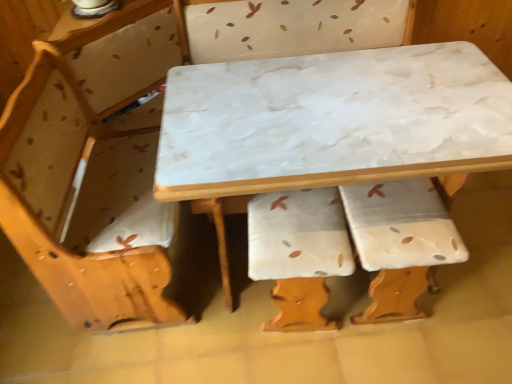
Measure the distance between point (305, 105) and camera.

A distance of 4.21 feet exists between point (305, 105) and camera.

Identify the location of white marble tablecloth at center. The width and height of the screenshot is (512, 384). (332, 120).

Describe the element at coordinates (332, 120) in the screenshot. I see `white marble tablecloth at center` at that location.

This screenshot has height=384, width=512. Find the location of `white marble tablecloth at center`. white marble tablecloth at center is located at coordinates [332, 120].